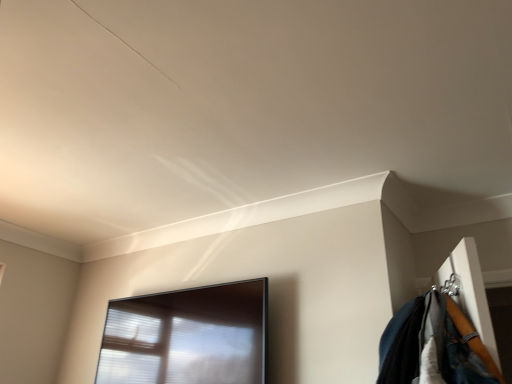
You are a GUI agent. You are given a task and a screenshot of the screen. Output one action in this format:
    pyautogui.click(x=<x>, y=<y>)
    Task: Click on the transparent glass window at center
    
    Given the screenshot: What is the action you would take?
    pyautogui.click(x=187, y=336)

The height and width of the screenshot is (384, 512). What do you see at coordinates (187, 336) in the screenshot?
I see `transparent glass window at center` at bounding box center [187, 336].

Measure the distance between point (181, 326) and camera.

Point (181, 326) is 7.04 feet from camera.

The height and width of the screenshot is (384, 512). I want to click on transparent glass window at center, so click(x=187, y=336).